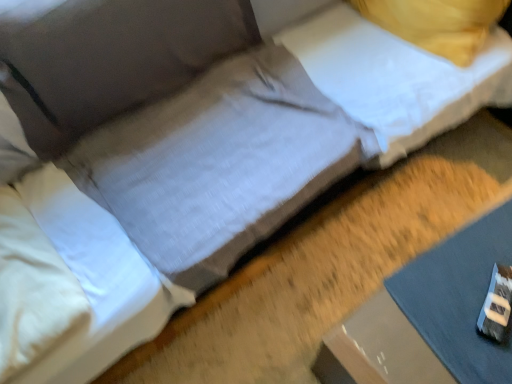
Question: From the image's perspective, would you say white soft pillow at upper right, which is counted as the 2th pillow, starting from the bottom, is positioned over gray fabric sheet at lower right?

Choices:
 (A) no
 (B) yes

Answer: (B)

Question: From a real-world perspective, does white soft pillow at upper right, which is the 2th pillow in front-to-back order, stand above gray fabric sheet at lower right?

Choices:
 (A) no
 (B) yes

Answer: (B)

Question: Is white soft pillow at upper right, the 2th pillow in the left-to-right sequence, completely or partially outside of gray fabric sheet at lower right?

Choices:
 (A) no
 (B) yes

Answer: (B)

Question: Does white soft pillow at upper right, which is the 2th pillow in front-to-back order, have a larger size compared to gray fabric sheet at lower right?

Choices:
 (A) yes
 (B) no

Answer: (A)

Question: Is white soft pillow at upper right, which is counted as the 1th pillow, starting from the back, shorter than gray fabric sheet at lower right?

Choices:
 (A) yes
 (B) no

Answer: (B)

Question: Considering the positions of white soft pillow at left, the second pillow when ordered from back to front, and gray fabric sheet at lower right in the image, is white soft pillow at left, the second pillow when ordered from back to front, taller or shorter than gray fabric sheet at lower right?

Choices:
 (A) short
 (B) tall

Answer: (B)

Question: Looking at their shapes, would you say white soft pillow at left, which is the 1th pillow in front-to-back order, is wider or thinner than gray fabric sheet at lower right?

Choices:
 (A) wide
 (B) thin

Answer: (A)

Question: Is white soft pillow at left, which is the 1th pillow in front-to-back order, bigger or smaller than gray fabric sheet at lower right?

Choices:
 (A) small
 (B) big

Answer: (B)

Question: From the image's perspective, relative to gray fabric sheet at lower right, is white soft pillow at left, which is the 1th pillow in front-to-back order, above or below?

Choices:
 (A) above
 (B) below

Answer: (A)

Question: Is point (411, 314) positioned closer to the camera than point (500, 31)?

Choices:
 (A) closer
 (B) farther

Answer: (A)

Question: From a real-world perspective, is gray fabric sheet at lower right positioned above or below white soft pillow at upper right, which is the 2th pillow in front-to-back order?

Choices:
 (A) below
 (B) above

Answer: (A)

Question: In terms of width, does gray fabric sheet at lower right look wider or thinner when compared to white soft pillow at upper right, the first pillow in the top-to-bottom sequence?

Choices:
 (A) wide
 (B) thin

Answer: (A)

Question: From the image's perspective, is gray fabric sheet at lower right positioned above or below white soft pillow at upper right, which is counted as the 2th pillow, starting from the bottom?

Choices:
 (A) above
 (B) below

Answer: (B)

Question: Considering their positions, is white soft pillow at upper right, which ranks as the 1th pillow in right-to-left order, located in front of or behind gray fabric sheet at lower right?

Choices:
 (A) front
 (B) behind

Answer: (B)

Question: Visually, is white soft pillow at upper right, which is counted as the 2th pillow, starting from the bottom, positioned to the left or to the right of gray fabric sheet at lower right?

Choices:
 (A) left
 (B) right

Answer: (A)